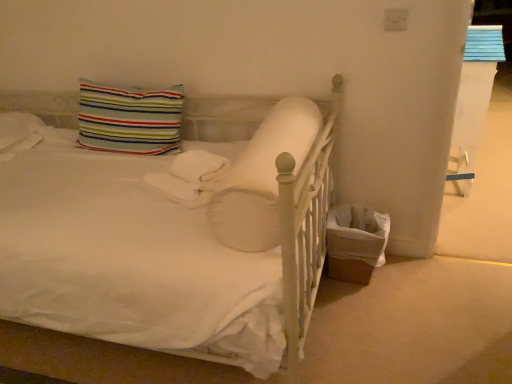
Question: Is white soft pillow at center, marked as the first pillow in a front-to-back arrangement, shorter than striped fabric pillow at upper left, which is the first pillow in left-to-right order?

Choices:
 (A) no
 (B) yes

Answer: (B)

Question: Are white soft pillow at center, which is the 2th pillow from left to right, and striped fabric pillow at upper left, the second pillow in the right-to-left sequence, far apart?

Choices:
 (A) yes
 (B) no

Answer: (B)

Question: Could you tell me if white soft pillow at center, placed as the 2th pillow when sorted from back to front, is turned towards striped fabric pillow at upper left, marked as the 1th pillow in a back-to-front arrangement?

Choices:
 (A) no
 (B) yes

Answer: (A)

Question: From a real-world perspective, is white soft pillow at center, placed as the 2th pillow when sorted from back to front, positioned under striped fabric pillow at upper left, marked as the 2th pillow in a front-to-back arrangement, based on gravity?

Choices:
 (A) yes
 (B) no

Answer: (A)

Question: Considering the relative sizes of white soft pillow at center, marked as the first pillow in a front-to-back arrangement, and striped fabric pillow at upper left, the second pillow in the right-to-left sequence, in the image provided, is white soft pillow at center, marked as the first pillow in a front-to-back arrangement, thinner than striped fabric pillow at upper left, the second pillow in the right-to-left sequence,?

Choices:
 (A) yes
 (B) no

Answer: (B)

Question: Is white soft pillow at center, which is the 2th pillow from left to right, at the left side of striped fabric pillow at upper left, which is the first pillow in left-to-right order?

Choices:
 (A) yes
 (B) no

Answer: (B)

Question: Does striped fabric pillow at upper left, marked as the 1th pillow in a back-to-front arrangement, have a larger size compared to white soft pillow at center, placed as the 2th pillow when sorted from back to front?

Choices:
 (A) yes
 (B) no

Answer: (B)

Question: Does striped fabric pillow at upper left, marked as the 1th pillow in a back-to-front arrangement, appear on the right side of white soft pillow at center, the 1th pillow viewed from the right?

Choices:
 (A) yes
 (B) no

Answer: (B)

Question: Is striped fabric pillow at upper left, the second pillow in the right-to-left sequence, in front of white soft pillow at center, marked as the first pillow in a front-to-back arrangement?

Choices:
 (A) yes
 (B) no

Answer: (B)

Question: Can you confirm if striped fabric pillow at upper left, marked as the 2th pillow in a front-to-back arrangement, is wider than white soft pillow at center, marked as the first pillow in a front-to-back arrangement?

Choices:
 (A) no
 (B) yes

Answer: (A)

Question: From the image's perspective, is striped fabric pillow at upper left, the second pillow in the right-to-left sequence, on white soft pillow at center, which is the 2th pillow from left to right?

Choices:
 (A) yes
 (B) no

Answer: (A)

Question: Is white soft pillow at center, placed as the 2th pillow when sorted from back to front, surrounded by striped fabric pillow at upper left, marked as the 2th pillow in a front-to-back arrangement?

Choices:
 (A) no
 (B) yes

Answer: (A)

Question: Is striped fabric pillow at upper left, the second pillow in the right-to-left sequence, inside the boundaries of white soft pillow at center, which is the 2th pillow from left to right, or outside?

Choices:
 (A) inside
 (B) outside

Answer: (B)